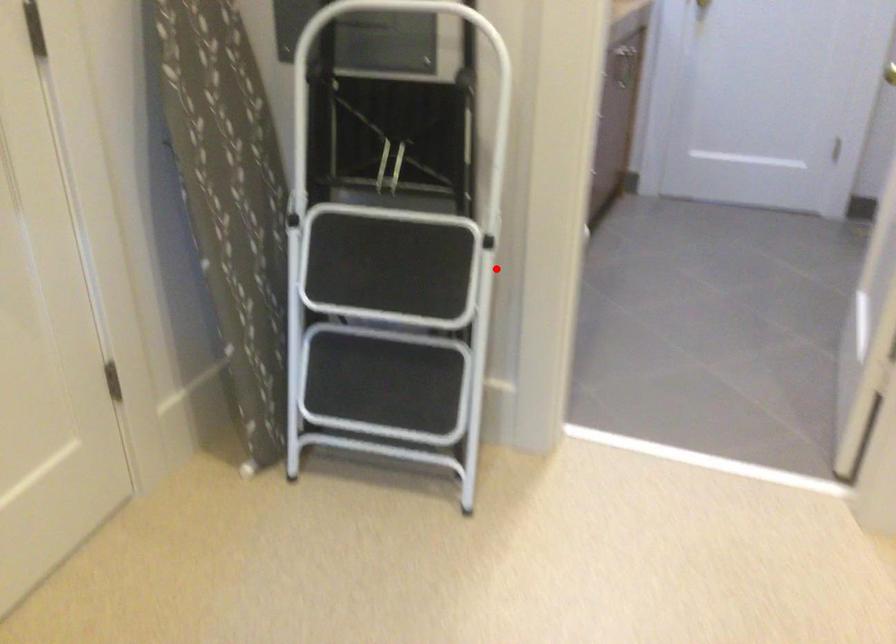
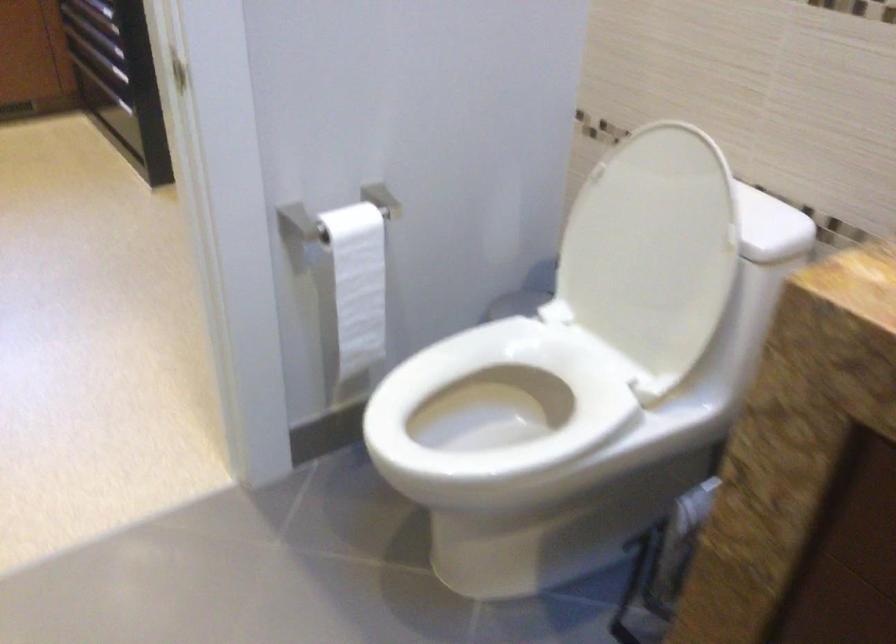
Where in the second image is the point corresponding to the highlighted location from the first image?

(357, 283)